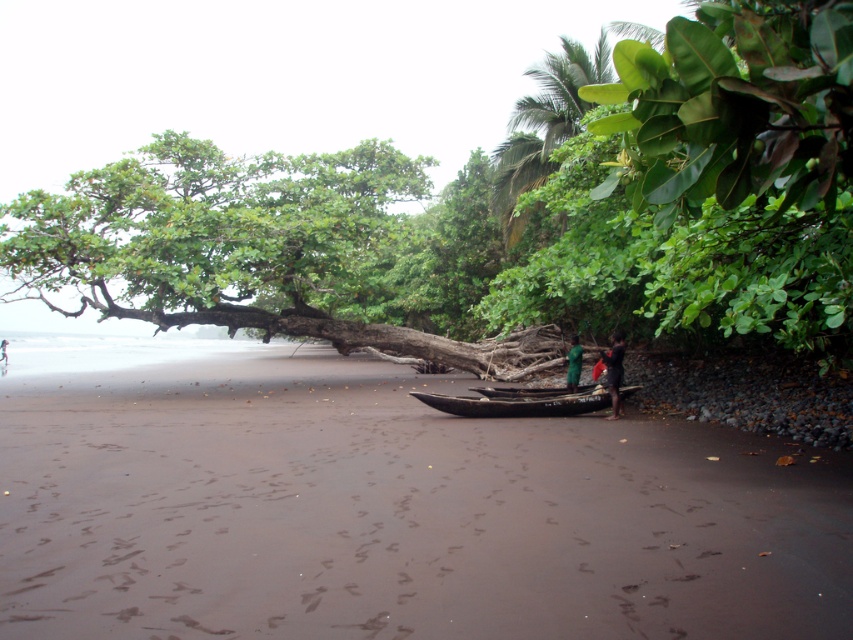
You are a photographer trying to capture the black wood boat at center and the green leafy tree at upper left in the same frame. Which object should you focus on first if you want to include both in your photo without zooming in or out?

The green leafy tree at upper left is bigger than the black wood boat at center, so you should focus on the green leafy tree at upper left first to ensure it fits in the frame while still capturing the smaller black wood boat at center.

You are standing at the point with coordinates point (518, 392). Which object are you on?

You are on the dark brown wooden canoe at center.

Looking at this image, you are a photographer trying to capture the entire black wood boat at center and green leafy tree at upper left in one frame. Based on the scene, which object would require you to adjust your camera angle more to ensure both are fully visible?

The green leafy tree at upper left might be wider than black wood boat at center, so you would need to adjust your camera angle more to include the entire width of the green leafy tree at upper left in the frame.